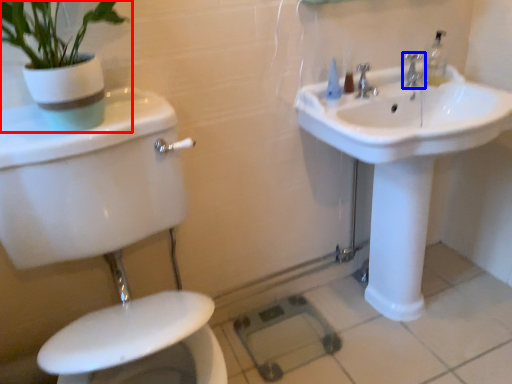
Question: Which of the following is the farthest to the observer, houseplant (highlighted by a red box) or tap (highlighted by a blue box)?

Choices:
 (A) houseplant
 (B) tap

Answer: (B)